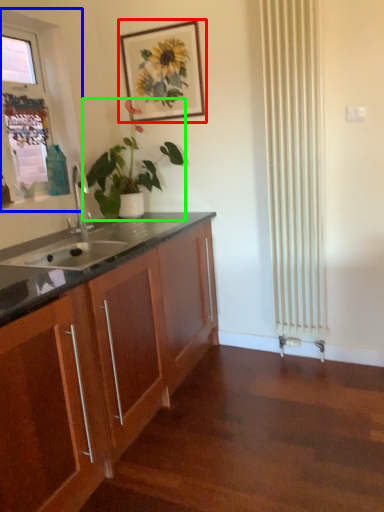
Question: Based on their relative distances, which object is farther from picture frame (highlighted by a red box)? Choose from window frame (highlighted by a blue box) and houseplant (highlighted by a green box).

Choices:
 (A) window frame
 (B) houseplant

Answer: (A)